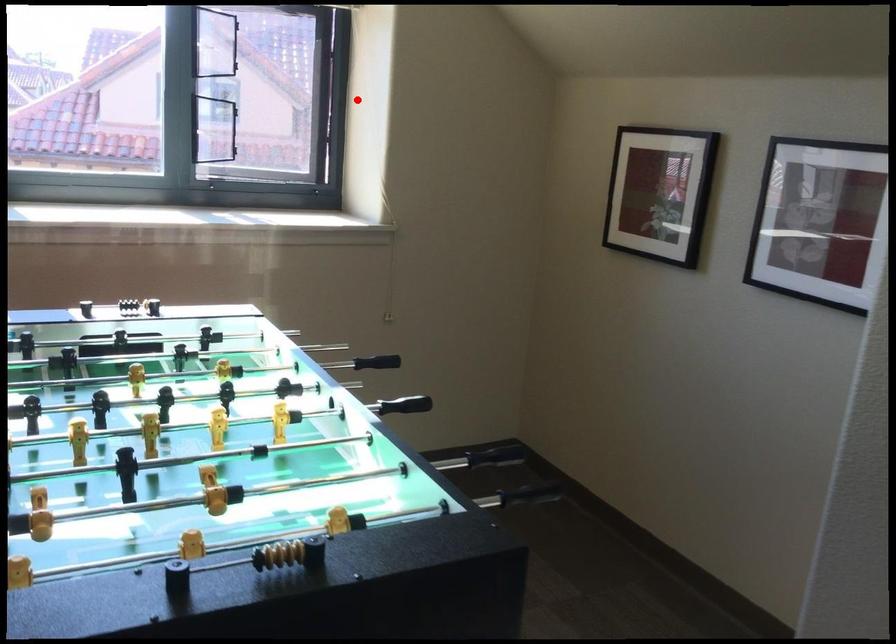
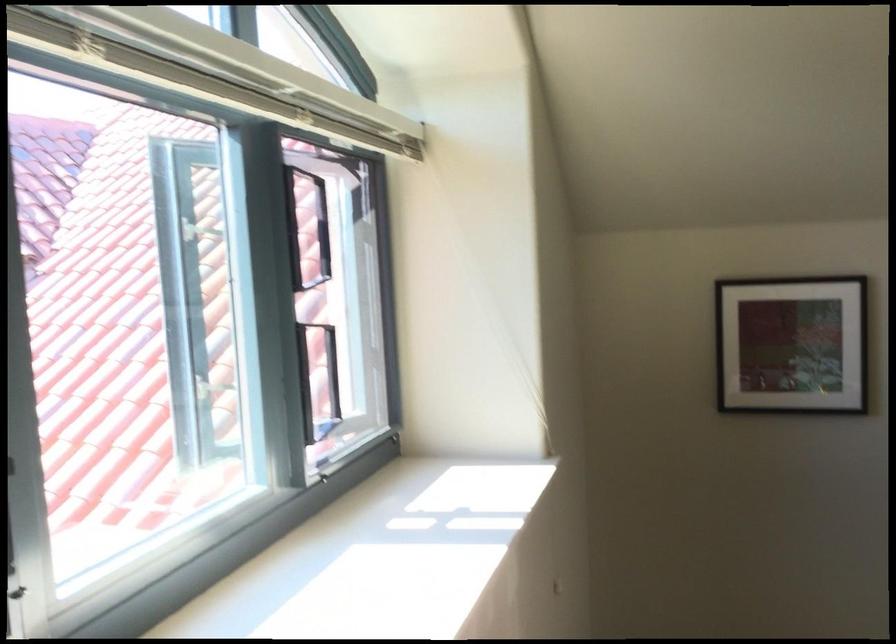
Locate, in the second image, the point that corresponds to the highlighted location in the first image.

(483, 298)